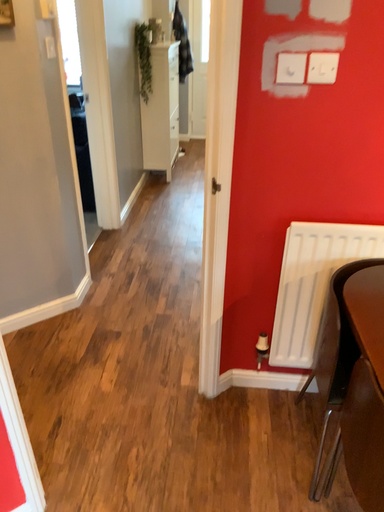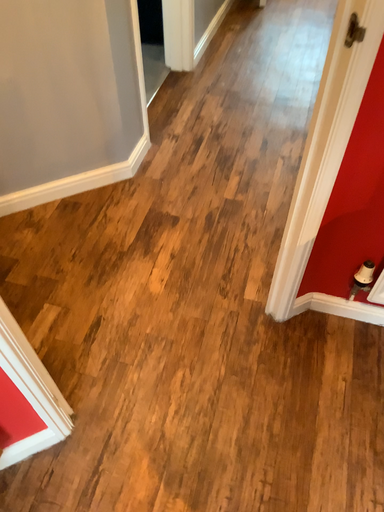
Question: How did the camera likely rotate when shooting the video?

Choices:
 (A) rotated upward
 (B) rotated downward

Answer: (B)